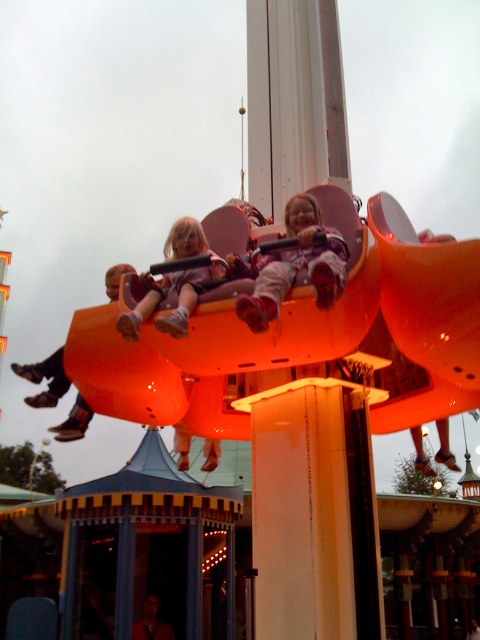
You are a parent at the amusement park and see your child sitting on the orange glossy ride at center and wearing matte pink pants at center. Can you tell me which object is bigger?

The orange glossy ride at center is larger than the matte pink pants at center.